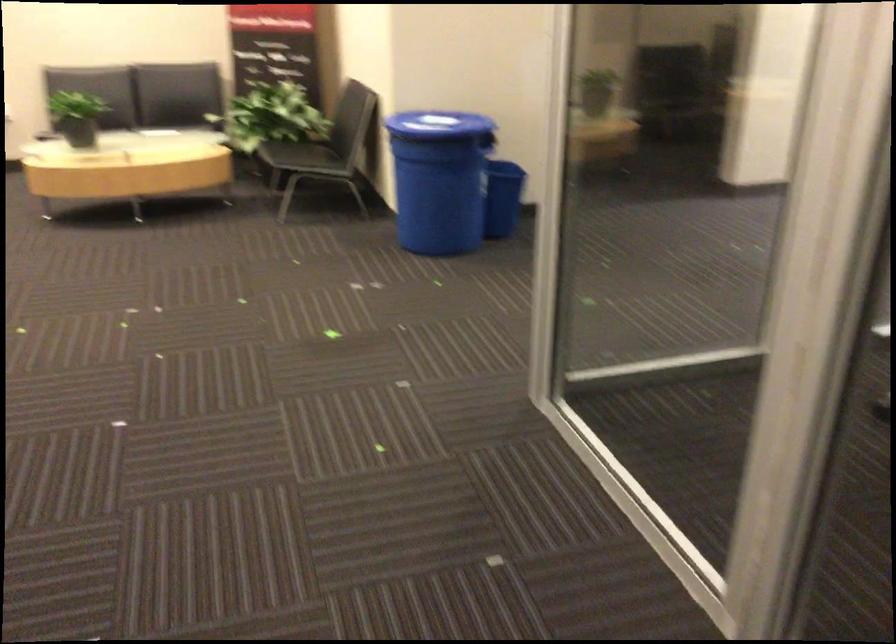
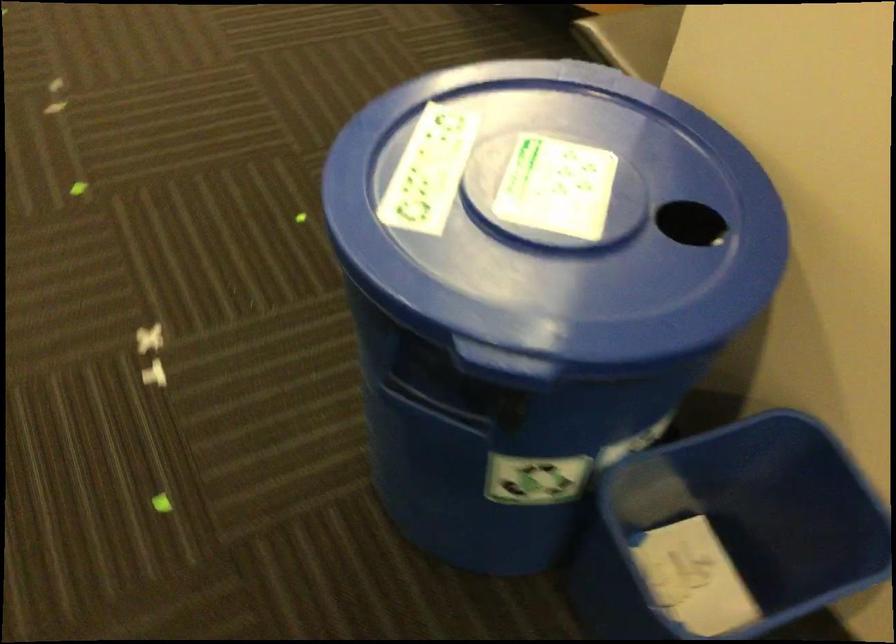
Where in the second image is the point corresponding to point (446, 109) from the first image?

(561, 220)